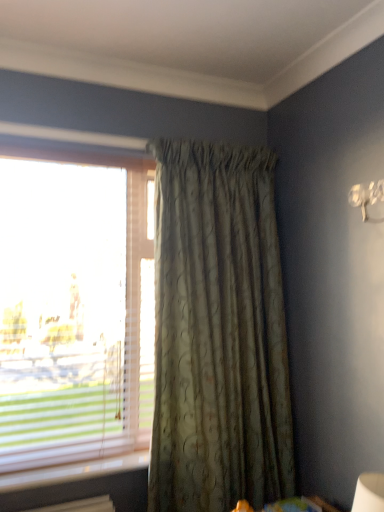
What do you see at coordinates (74, 303) in the screenshot? I see `translucent glass window at left` at bounding box center [74, 303].

Where is `translucent glass window at left`? The width and height of the screenshot is (384, 512). translucent glass window at left is located at coordinates (74, 303).

Find the location of a particular element. green textured curtain at center is located at coordinates (218, 332).

This screenshot has height=512, width=384. Describe the element at coordinates (218, 332) in the screenshot. I see `green textured curtain at center` at that location.

I want to click on translucent glass window at left, so click(74, 303).

Based on the photo, between green textured curtain at center and translucent glass window at left, which one appears on the right side from the viewer's perspective?

green textured curtain at center.

Who is more distant, green textured curtain at center or translucent glass window at left?

Positioned behind is translucent glass window at left.

Does point (230, 465) appear closer or farther from the camera than point (142, 260)?

Point (230, 465) is positioned closer to the camera compared to point (142, 260).

From the image's perspective, is green textured curtain at center above or below translucent glass window at left?

Based on their image positions, green textured curtain at center is located beneath translucent glass window at left.

Looking at this image, from a real-world perspective, is green textured curtain at center located beneath translucent glass window at left?

Yes.

Can you confirm if green textured curtain at center is thinner than translucent glass window at left?

Incorrect, the width of green textured curtain at center is not less than that of translucent glass window at left.

Does green textured curtain at center have a lesser height compared to translucent glass window at left?

No, green textured curtain at center is not shorter than translucent glass window at left.

Considering the relative sizes of green textured curtain at center and translucent glass window at left in the image provided, is green textured curtain at center smaller than translucent glass window at left?

No, green textured curtain at center is not smaller than translucent glass window at left.

Is green textured curtain at center inside or outside of translucent glass window at left?

green textured curtain at center is located beyond the bounds of translucent glass window at left.

Is green textured curtain at center beside translucent glass window at left?

They are not placed beside each other.

Is green textured curtain at center facing towards translucent glass window at left?

No, green textured curtain at center is not aimed at translucent glass window at left.

What's the angular difference between green textured curtain at center and translucent glass window at left's facing directions?

The facing directions of green textured curtain at center and translucent glass window at left are 0.314 degrees apart.

Measure the distance from green textured curtain at center to translucent glass window at left.

The distance of green textured curtain at center from translucent glass window at left is 16.08 inches.

The width and height of the screenshot is (384, 512). Find the location of `window behind the green textured curtain at center`. window behind the green textured curtain at center is located at coordinates (74, 303).

Considering the relative positions of translucent glass window at left and green textured curtain at center in the image provided, is translucent glass window at left to the right of green textured curtain at center from the viewer's perspective?

Incorrect, translucent glass window at left is not on the right side of green textured curtain at center.

Relative to green textured curtain at center, is translucent glass window at left in front or behind?

Visually, translucent glass window at left is located behind green textured curtain at center.

Is point (34, 444) less distant than point (163, 420)?

Yes, point (34, 444) is closer to viewer.

From the image's perspective, is translucent glass window at left on top of green textured curtain at center?

Yes, from the image's perspective, translucent glass window at left is over green textured curtain at center.

From a real-world perspective, who is located higher, translucent glass window at left or green textured curtain at center?

translucent glass window at left, from a real-world perspective.

Is translucent glass window at left wider or thinner than green textured curtain at center?

Considering their sizes, translucent glass window at left looks slimmer than green textured curtain at center.

Is translucent glass window at left shorter than green textured curtain at center?

Indeed, translucent glass window at left has a lesser height compared to green textured curtain at center.

In the scene shown: Can you confirm if translucent glass window at left is smaller than green textured curtain at center?

Indeed, translucent glass window at left has a smaller size compared to green textured curtain at center.

Do you think translucent glass window at left is within green textured curtain at center, or outside of it?

translucent glass window at left is spatially situated outside green textured curtain at center.

Would you say translucent glass window at left is a long distance from green textured curtain at center?

No, translucent glass window at left is in close proximity to green textured curtain at center.

Is translucent glass window at left oriented towards green textured curtain at center?

No, translucent glass window at left is not turned towards green textured curtain at center.

How different are the orientations of translucent glass window at left and green textured curtain at center in degrees?

They differ by 0.314 degrees in their facing directions.

Where is `curtain that appears in front of the translucent glass window at left`? curtain that appears in front of the translucent glass window at left is located at coordinates (218, 332).

Find the location of a particular element. The image size is (384, 512). curtain located below the translucent glass window at left (from the image's perspective) is located at coordinates (218, 332).

This screenshot has height=512, width=384. I want to click on window that appears above the green textured curtain at center (from a real-world perspective), so click(x=74, y=303).